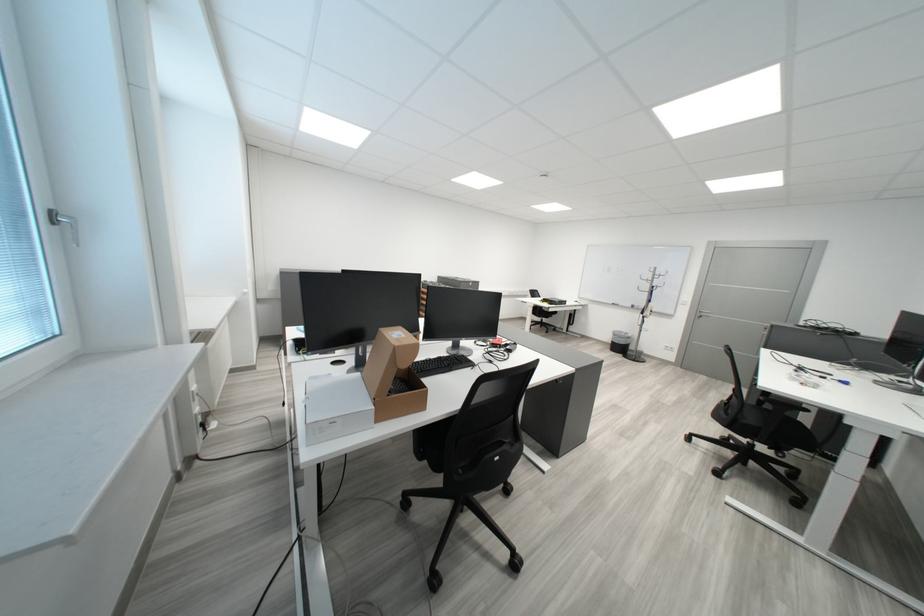
Which object does [440,365] point to?

It refers to a black computer keyboard.